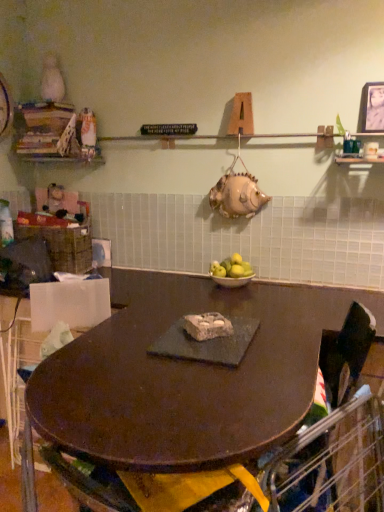
Where is `metallic silver photo frame at upper right`? metallic silver photo frame at upper right is located at coordinates (371, 108).

This screenshot has height=512, width=384. Describe the element at coordinates (371, 108) in the screenshot. I see `metallic silver photo frame at upper right` at that location.

At what (x,y) coordinates should I click in order to perform the action: click on wooden books at upper left. Please return your answer as a coordinate pair (x, y). The height and width of the screenshot is (512, 384). Looking at the image, I should click on (58, 134).

Describe the element at coordinates (231, 267) in the screenshot. I see `yellow matte apples at center` at that location.

In order to click on yellow matte apples at center in this screenshot , I will do `click(231, 267)`.

This screenshot has width=384, height=512. Describe the element at coordinates (188, 374) in the screenshot. I see `dark brown wood table at center` at that location.

Describe the element at coordinates (335, 439) in the screenshot. I see `black fabric swivel chair at center` at that location.

Find the location of a particular element. The height and width of the screenshot is (512, 384). metallic silver photo frame at upper right is located at coordinates (371, 108).

From a real-world perspective, which object stands above the other?

yellow matte apples at center, from a real-world perspective.

Can you confirm if yellow matte apples at center is taller than dark brown wood table at center?

Incorrect, the height of yellow matte apples at center is not larger of that of dark brown wood table at center.

Where is `table in front of the yellow matte apples at center`? The height and width of the screenshot is (512, 384). table in front of the yellow matte apples at center is located at coordinates (188, 374).

Based on the photo, could you tell me if yellow matte apples at center is turned towards dark brown wood table at center?

No.

In terms of size, does yellow matte apples at center appear bigger or smaller than woven brown basket at left?

Clearly, yellow matte apples at center is smaller in size than woven brown basket at left.

From the image's perspective, which is above, yellow matte apples at center or woven brown basket at left?

woven brown basket at left.

Is the depth of yellow matte apples at center less than that of woven brown basket at left?

Yes, it is.

In the image, is metallic silver photo frame at upper right positioned in front of or behind wooden books at upper left?

In the image, metallic silver photo frame at upper right appears in front of wooden books at upper left.

From the image's perspective, which is below, metallic silver photo frame at upper right or wooden books at upper left?

metallic silver photo frame at upper right, from the image's perspective.

Between metallic silver photo frame at upper right and wooden books at upper left, which one has more height?

With more height is wooden books at upper left.

In the image, is metallic silver photo frame at upper right on the left side or the right side of wooden books at upper left?

In the image, metallic silver photo frame at upper right appears on the right side of wooden books at upper left.

From a real-world perspective, which object rests below the other?

black fabric swivel chair at center, from a real-world perspective.

Is black fabric swivel chair at center not within woven brown basket at left?

Yes, black fabric swivel chair at center is not within woven brown basket at left.

Considering the sizes of objects black fabric swivel chair at center and woven brown basket at left in the image provided, who is thinner, black fabric swivel chair at center or woven brown basket at left?

Thinner between the two is woven brown basket at left.

Is black fabric swivel chair at center placed right next to dark brown wood table at center?

No, black fabric swivel chair at center is not in contact with dark brown wood table at center.

From a real-world perspective, which object rests below the other?

From a 3D spatial view, dark brown wood table at center is below.

Is black fabric swivel chair at center positioned beyond the bounds of dark brown wood table at center?

That's incorrect, black fabric swivel chair at center is not completely outside dark brown wood table at center.

Which is nearer, (322, 482) or (271, 291)?

The point (322, 482) is in front.

Identify the location of basket lying on the left of metallic silver photo frame at upper right. (62, 245).

Considering the points (71, 248) and (383, 127), which point is behind, point (71, 248) or point (383, 127)?

The point (71, 248) is behind.

In the image, is woven brown basket at left positioned in front of or behind metallic silver photo frame at upper right?

In the image, woven brown basket at left appears behind metallic silver photo frame at upper right.

Is woven brown basket at left oriented towards metallic silver photo frame at upper right?

No, woven brown basket at left is not oriented towards metallic silver photo frame at upper right.

How many degrees apart are the facing directions of wooden books at upper left and woven brown basket at left?

The angle between the facing direction of wooden books at upper left and the facing direction of woven brown basket at left is 0.265 degrees.

From the image's perspective, between wooden books at upper left and woven brown basket at left, which one is located above?

From the image's view, wooden books at upper left is above.

Considering the relative sizes of wooden books at upper left and woven brown basket at left in the image provided, is wooden books at upper left smaller than woven brown basket at left?

Indeed, wooden books at upper left has a smaller size compared to woven brown basket at left.

Which object is thinner, wooden books at upper left or woven brown basket at left?

Thinner between the two is wooden books at upper left.

Where is `table in front of the yellow matte apples at center`? This screenshot has height=512, width=384. table in front of the yellow matte apples at center is located at coordinates (188, 374).

Identify the location of basket on the left of the yellow matte apples at center. The image size is (384, 512). (62, 245).

When comparing their distances from yellow matte apples at center, does woven brown basket at left or dark brown wood table at center seem closer?

dark brown wood table at center.

From the picture: Which object lies further to the anchor point woven brown basket at left, yellow matte apples at center or metallic silver photo frame at upper right?

The object further to woven brown basket at left is metallic silver photo frame at upper right.

When comparing their distances from black fabric swivel chair at center, does wooden books at upper left or dark brown wood table at center seem closer?

dark brown wood table at center.

When comparing their distances from metallic silver photo frame at upper right, does black fabric swivel chair at center or dark brown wood table at center seem closer?

Among the two, dark brown wood table at center is located nearer to metallic silver photo frame at upper right.

Which object lies nearer to the anchor point woven brown basket at left, dark brown wood table at center or metallic silver photo frame at upper right?

Among the two, dark brown wood table at center is located nearer to woven brown basket at left.

When comparing their distances from metallic silver photo frame at upper right, does woven brown basket at left or black fabric swivel chair at center seem further?

Based on the image, woven brown basket at left appears to be further to metallic silver photo frame at upper right.

Estimate the real-world distances between objects in this image. Which object is further from metallic silver photo frame at upper right, wooden books at upper left or woven brown basket at left?

Among the two, woven brown basket at left is located further to metallic silver photo frame at upper right.

Based on their spatial positions, is dark brown wood table at center or black fabric swivel chair at center further from wooden books at upper left?

The object further to wooden books at upper left is black fabric swivel chair at center.

The image size is (384, 512). In order to click on table between wooden books at upper left and metallic silver photo frame at upper right in the horizontal direction in this screenshot , I will do `click(188, 374)`.

The image size is (384, 512). I want to click on apple between woven brown basket at left and metallic silver photo frame at upper right from left to right, so click(231, 267).

Locate an element on the screen. The height and width of the screenshot is (512, 384). swivel chair between dark brown wood table at center and yellow matte apples at center along the z-axis is located at coordinates (335, 439).

Image resolution: width=384 pixels, height=512 pixels. I want to click on basket between wooden books at upper left and metallic silver photo frame at upper right, so click(62, 245).